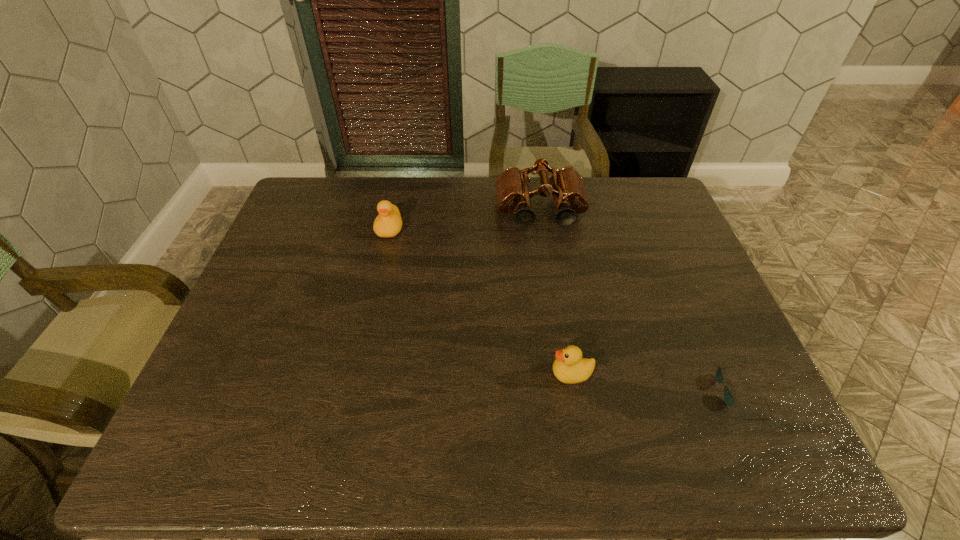
Locate an element on the screen. This screenshot has width=960, height=540. free space between the nearer duck and the farther duck is located at coordinates (481, 301).

Find the location of `vacant area that lies between the tallest object and the leftmost object`. vacant area that lies between the tallest object and the leftmost object is located at coordinates (465, 220).

This screenshot has width=960, height=540. I want to click on vacant space in between the tallest object and the right duck, so click(556, 292).

Locate which object is the third closest to the farther duck. Please provide its 2D coordinates. Your answer should be formatted as a tuple, i.e. [(x, y)], where the tuple contains the x and y coordinates of a point satisfying the conditions above.

[(728, 397)]

Find the location of a particular element. The image size is (960, 540). object that is the closest to the nearer duck is located at coordinates click(728, 397).